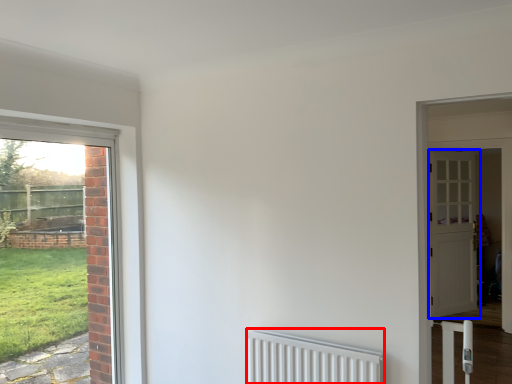
Question: Among these objects, which one is farthest to the camera, radiator (highlighted by a red box) or door (highlighted by a blue box)?

Choices:
 (A) radiator
 (B) door

Answer: (B)